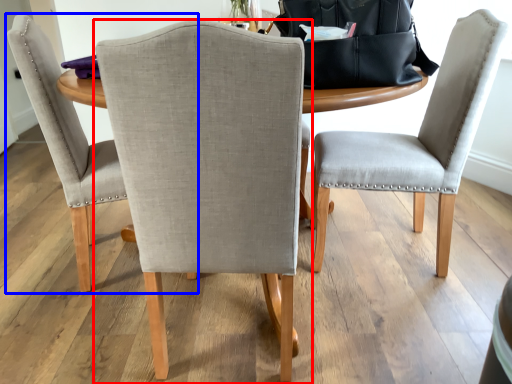
Question: Which object is closer to the camera taking this photo, chair (highlighted by a red box) or chair (highlighted by a blue box)?

Choices:
 (A) chair
 (B) chair

Answer: (A)